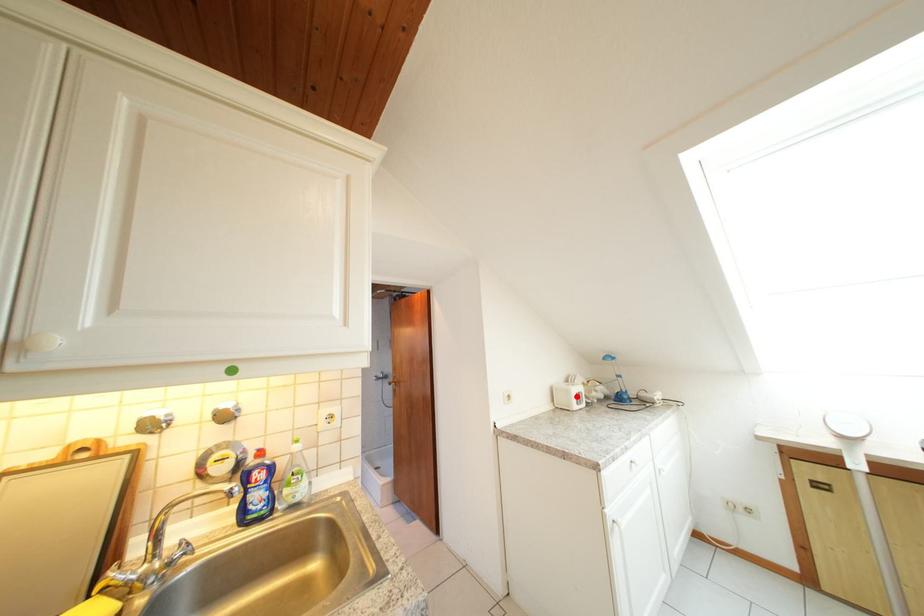
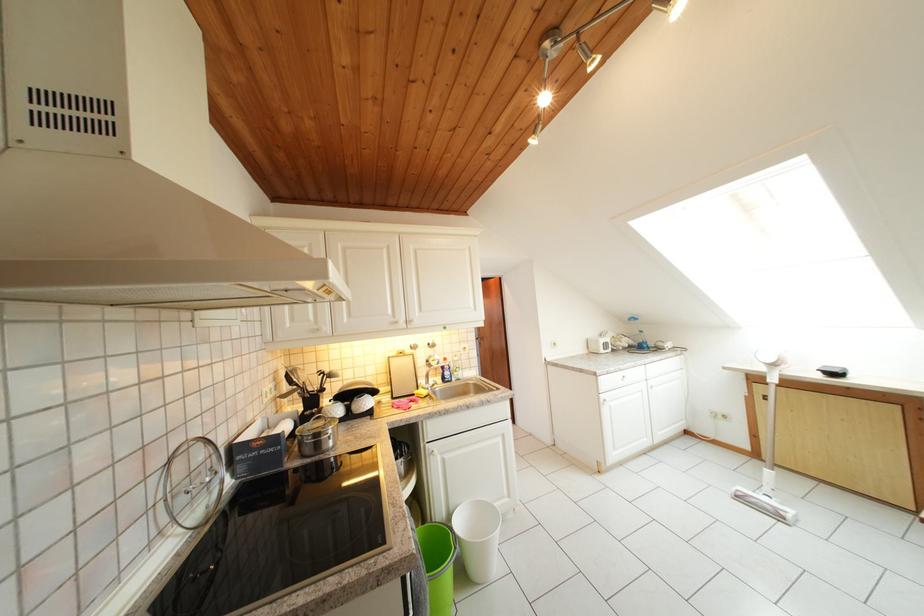
Where in the second image is the point corresponding to the highlighted location from the first image?

(605, 347)